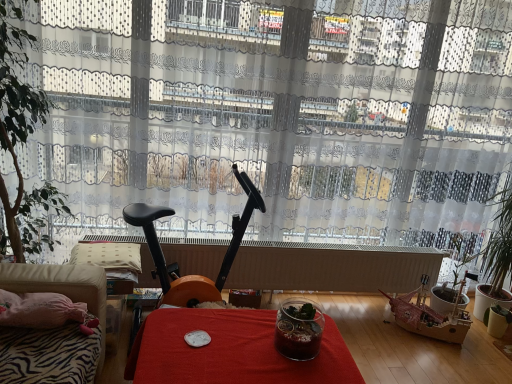
Question: From the image's perspective, is velvet beige couch at lower left located beneath black plastic exercise bike at center?

Choices:
 (A) yes
 (B) no

Answer: (A)

Question: Is velvet beige couch at lower left facing away from black plastic exercise bike at center?

Choices:
 (A) yes
 (B) no

Answer: (B)

Question: Is velvet beige couch at lower left taller than black plastic exercise bike at center?

Choices:
 (A) yes
 (B) no

Answer: (B)

Question: Considering the relative sizes of velvet beige couch at lower left and black plastic exercise bike at center in the image provided, is velvet beige couch at lower left bigger than black plastic exercise bike at center?

Choices:
 (A) yes
 (B) no

Answer: (B)

Question: Is velvet beige couch at lower left at the right side of black plastic exercise bike at center?

Choices:
 (A) no
 (B) yes

Answer: (A)

Question: Could you tell me if velvet beige couch at lower left is turned towards black plastic exercise bike at center?

Choices:
 (A) no
 (B) yes

Answer: (A)

Question: Can you confirm if green leafy plant at right, positioned as the 2th houseplant in top-to-bottom order, is thinner than white matte radiator at center?

Choices:
 (A) no
 (B) yes

Answer: (A)

Question: Does green leafy plant at right, the 2th houseplant viewed from the front, come in front of white matte radiator at center?

Choices:
 (A) no
 (B) yes

Answer: (A)

Question: From a real-world perspective, is green leafy plant at right, the first houseplant ordered from the bottom, physically above white matte radiator at center?

Choices:
 (A) yes
 (B) no

Answer: (A)

Question: Considering the relative positions of green leafy plant at right, which is the first houseplant from right to left, and white matte radiator at center in the image provided, is green leafy plant at right, which is the first houseplant from right to left, to the left of white matte radiator at center from the viewer's perspective?

Choices:
 (A) yes
 (B) no

Answer: (B)

Question: Is green leafy plant at right, the first houseplant ordered from the bottom, placed right next to white matte radiator at center?

Choices:
 (A) no
 (B) yes

Answer: (A)

Question: Considering the relative sizes of green leafy plant at right, which is the first houseplant from right to left, and white matte radiator at center in the image provided, is green leafy plant at right, which is the first houseplant from right to left, taller than white matte radiator at center?

Choices:
 (A) yes
 (B) no

Answer: (A)

Question: Can you confirm if red fabric table at center is positioned to the left of green leafy plant at right, the first houseplant ordered from the bottom?

Choices:
 (A) yes
 (B) no

Answer: (A)